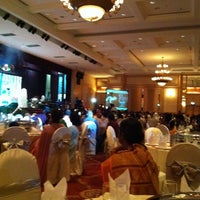
I want to click on white fancy paper on tables, so click(121, 192), click(59, 195).